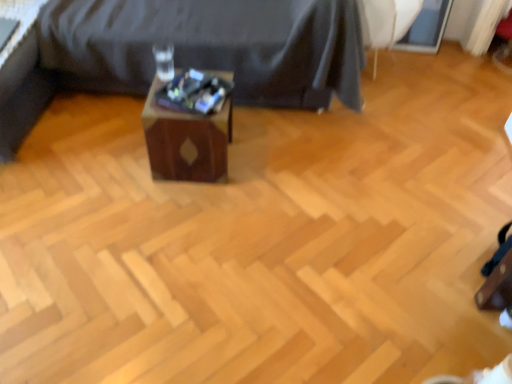
At what (x,y) coordinates should I click in order to perform the action: click on vacant space that is to the left of wooden box at center. Please return your answer as a coordinate pair (x, y). This screenshot has width=512, height=384. Looking at the image, I should click on (120, 161).